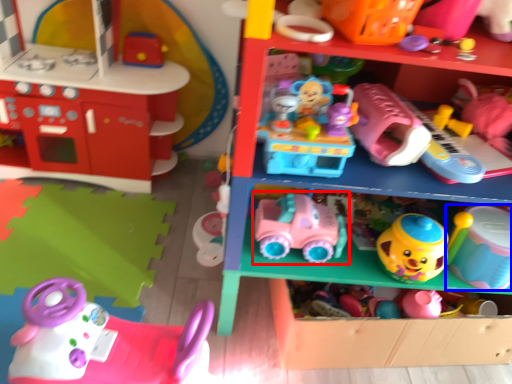
Question: Which object appears closest to the camera in this image, toy (highlighted by a red box) or toy (highlighted by a blue box)?

Choices:
 (A) toy
 (B) toy

Answer: (B)